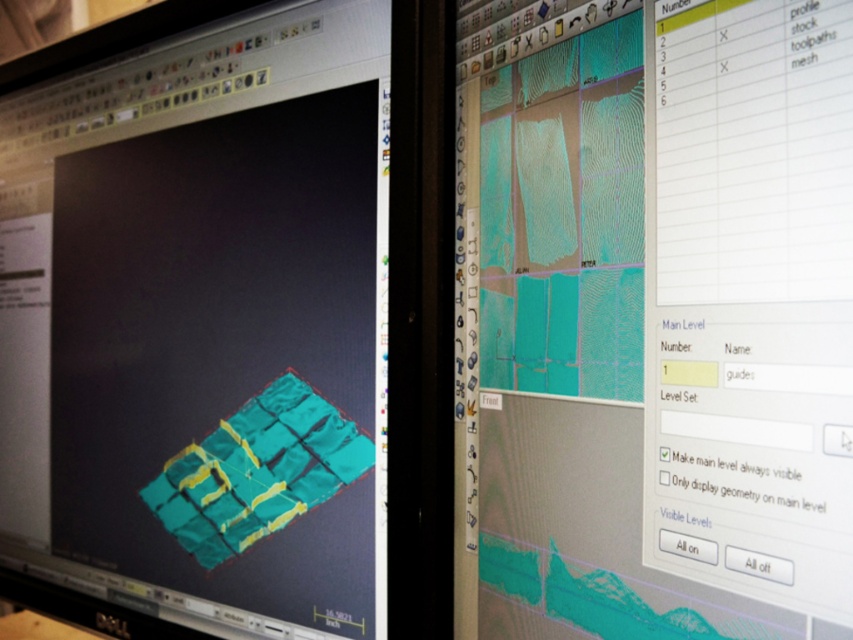
Between teal matte cube at center and teal matte mesh at center, which one has more height?

teal matte cube at center is taller.

Consider the image. Does teal matte cube at center lie behind teal matte mesh at center?

Yes, it is.

Identify the location of teal matte cube at center. Image resolution: width=853 pixels, height=640 pixels. (229, 323).